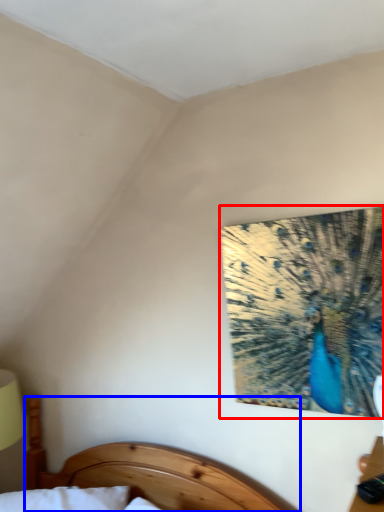
Question: Which point is closer to the camera, peacock (highlighted by a red box) or bed (highlighted by a blue box)?

Choices:
 (A) peacock
 (B) bed

Answer: (B)